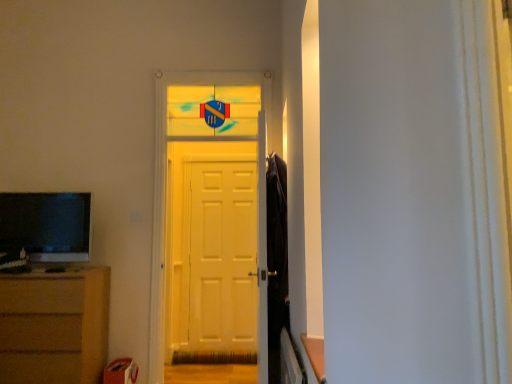
Question: From a real-world perspective, is brown wooden chest of drawers at lower left physically located above or below matte black television at left?

Choices:
 (A) below
 (B) above

Answer: (A)

Question: From the image's perspective, is brown wooden chest of drawers at lower left located above or below matte black television at left?

Choices:
 (A) below
 (B) above

Answer: (A)

Question: Based on their relative distances, which object is nearer to the white matte door at center?

Choices:
 (A) white glossy door at center
 (B) matte black television at left
 (C) brown wooden chest of drawers at lower left

Answer: (A)

Question: Considering the real-world distances, which object is farthest from the matte black television at left?

Choices:
 (A) white matte door at center
 (B) brown wooden chest of drawers at lower left
 (C) white glossy door at center

Answer: (A)